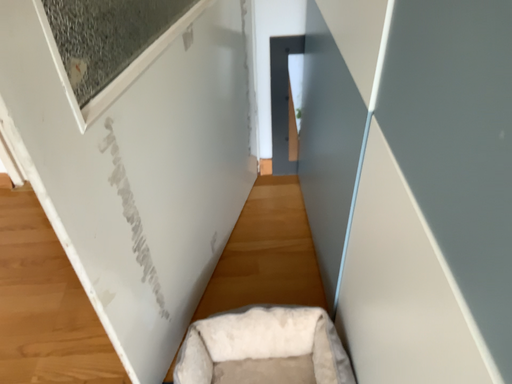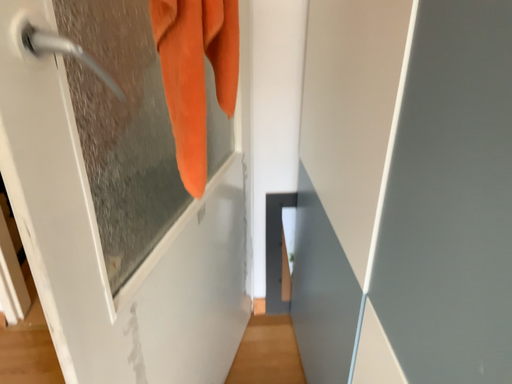
Question: How did the camera likely rotate when shooting the video?

Choices:
 (A) rotated downward
 (B) rotated upward

Answer: (B)